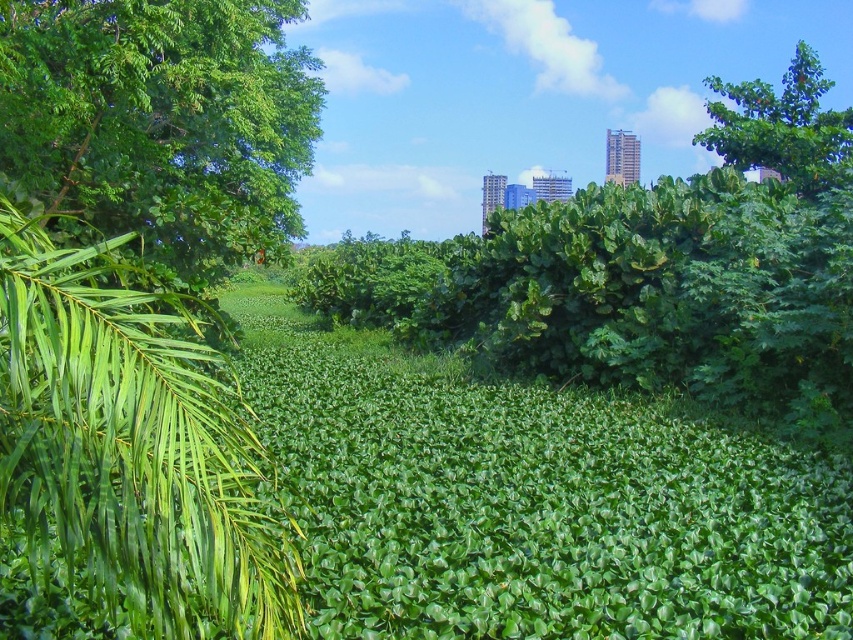
You are standing in the lush green landscape described. You see a point marked at coordinates (132, 445). Which object in the scene does this point belong to?

The point at coordinates (132, 445) is on the green leafy palm at left.

You are standing in the lush green landscape described. If you want to reach the green leafy palm at left, which direction should you move relative to your current position?

The green leafy palm at left is located at point 0.697 on the x and 0.157 on the y coordinates. Since the coordinates are relative to the image frame, moving towards the left side of the image would lead you to the green leafy palm at left.